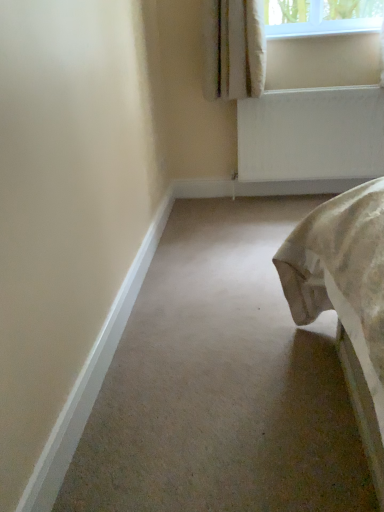
What are the coordinates of `white textured curtain at upper right` in the screenshot? It's located at (233, 49).

The image size is (384, 512). What do you see at coordinates (233, 49) in the screenshot?
I see `white textured curtain at upper right` at bounding box center [233, 49].

This screenshot has width=384, height=512. I want to click on white textured curtain at upper right, so click(233, 49).